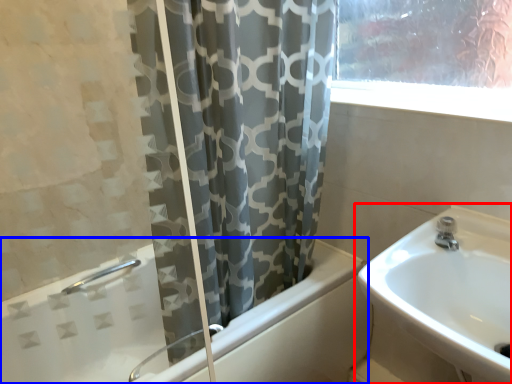
Question: Which object appears farthest to the camera in this image, sink (highlighted by a red box) or bathtub (highlighted by a blue box)?

Choices:
 (A) sink
 (B) bathtub

Answer: (B)